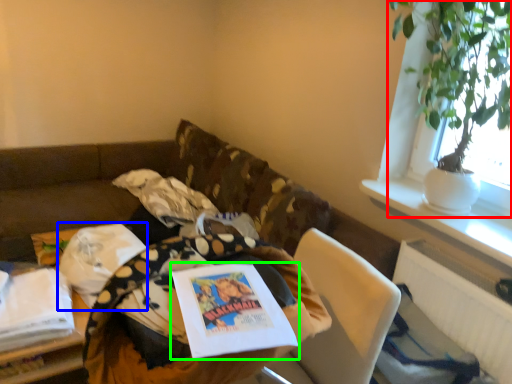
Question: Considering the real-world distances, which object is closest to houseplant (highlighted by a red box)? material (highlighted by a blue box) or book (highlighted by a green box).

Choices:
 (A) material
 (B) book

Answer: (B)